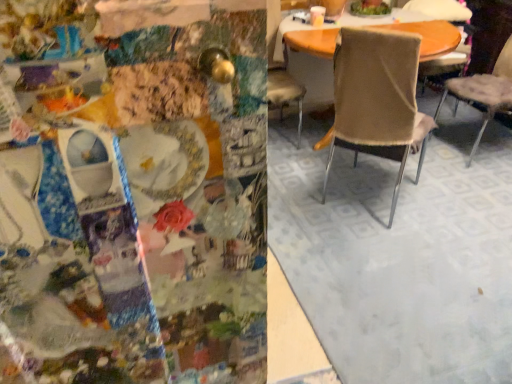
Question: Which direction should I rotate to face beige fabric chair at center, which is the 1th chair in left-to-right order, — up or down?

Choices:
 (A) down
 (B) up

Answer: (B)

Question: Can you confirm if beige fabric chair at center, positioned as the second chair in right-to-left order, is shorter than beige fabric chair at center, arranged as the third chair when viewed from the right?

Choices:
 (A) yes
 (B) no

Answer: (A)

Question: Can you confirm if beige fabric chair at center, positioned as the 3th chair in left-to-right order, is taller than beige fabric chair at center, arranged as the third chair when viewed from the right?

Choices:
 (A) no
 (B) yes

Answer: (A)

Question: Is beige fabric chair at center, positioned as the second chair in right-to-left order, thinner than beige fabric chair at center, arranged as the third chair when viewed from the right?

Choices:
 (A) yes
 (B) no

Answer: (B)

Question: Considering the relative sizes of beige fabric chair at center, positioned as the 3th chair in left-to-right order, and beige fabric chair at center, arranged as the third chair when viewed from the right, in the image provided, is beige fabric chair at center, positioned as the 3th chair in left-to-right order, smaller than beige fabric chair at center, arranged as the third chair when viewed from the right,?

Choices:
 (A) no
 (B) yes

Answer: (B)

Question: Does beige fabric chair at center, positioned as the second chair in right-to-left order, have a larger size compared to beige fabric chair at center, arranged as the third chair when viewed from the right?

Choices:
 (A) no
 (B) yes

Answer: (A)

Question: From a real-world perspective, is beige fabric chair at center, positioned as the second chair in right-to-left order, located beneath beige fabric chair at center, arranged as the third chair when viewed from the right?

Choices:
 (A) yes
 (B) no

Answer: (A)

Question: Considering the relative sizes of beige fabric chair at center, the fourth chair when ordered from left to right, and beige fabric chair at center, which is the 1th chair in left-to-right order, in the image provided, is beige fabric chair at center, the fourth chair when ordered from left to right, bigger than beige fabric chair at center, which is the 1th chair in left-to-right order,?

Choices:
 (A) yes
 (B) no

Answer: (A)

Question: Is beige fabric chair at center, which is counted as the 1th chair, starting from the right, facing away from beige fabric chair at center, marked as the fourth chair in a right-to-left arrangement?

Choices:
 (A) no
 (B) yes

Answer: (A)

Question: Does beige fabric chair at center, the fourth chair when ordered from left to right, have a lesser width compared to beige fabric chair at center, which is the 1th chair in left-to-right order?

Choices:
 (A) no
 (B) yes

Answer: (B)

Question: Is beige fabric chair at center, the fourth chair when ordered from left to right, smaller than beige fabric chair at center, marked as the fourth chair in a right-to-left arrangement?

Choices:
 (A) no
 (B) yes

Answer: (A)

Question: Is beige fabric chair at center, marked as the fourth chair in a right-to-left arrangement, a part of beige fabric chair at center, which is counted as the 1th chair, starting from the right?

Choices:
 (A) yes
 (B) no

Answer: (B)

Question: Is beige fabric chair at center, which is counted as the 1th chair, starting from the right, oriented towards beige fabric chair at center, which is the 1th chair in left-to-right order?

Choices:
 (A) no
 (B) yes

Answer: (B)

Question: Is beige fabric chair at center, positioned as the second chair in right-to-left order, not close to beige fabric chair at center, which is the 1th chair in left-to-right order?

Choices:
 (A) no
 (B) yes

Answer: (B)